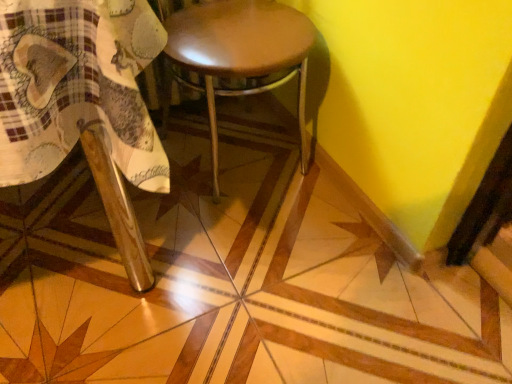
The width and height of the screenshot is (512, 384). What are the coordinates of `vacant space in wooden chair at lower left (from a real-world perspective)` in the screenshot? It's located at (82, 256).